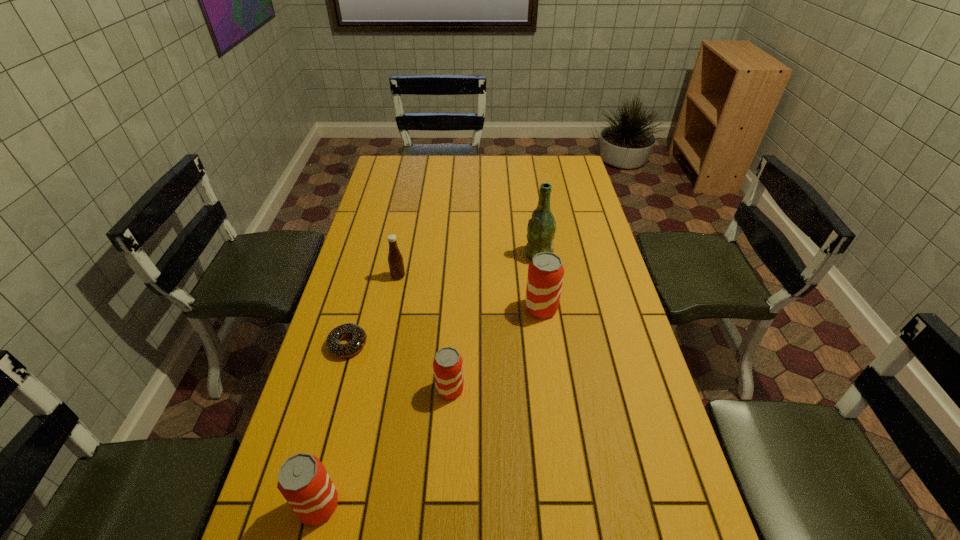
In the current image, all beer cans are evenly spaced. To maintain this equal spacing, where should an additional beer can be placed on the right? Please point out a free spot. Please provide its 2D coordinates. Your answer should be formatted as a tuple, i.e. [(x, y)], where the tuple contains the x and y coordinates of a point satisfying the conditions above.

[(608, 249)]